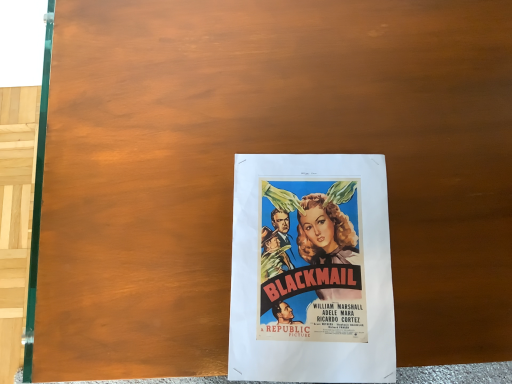
What do you see at coordinates (311, 269) in the screenshot? The width and height of the screenshot is (512, 384). I see `white paper poster at center` at bounding box center [311, 269].

This screenshot has height=384, width=512. In order to click on white paper poster at center in this screenshot , I will do `click(311, 269)`.

What is the approximate height of white paper poster at center?

It is 2.08 inches.

In order to face white paper poster at center, should I rotate leftwards or rightwards?

A 7.426 degree turn to the right will do.

This screenshot has height=384, width=512. What are the coordinates of `white paper poster at center` in the screenshot? It's located at (311, 269).